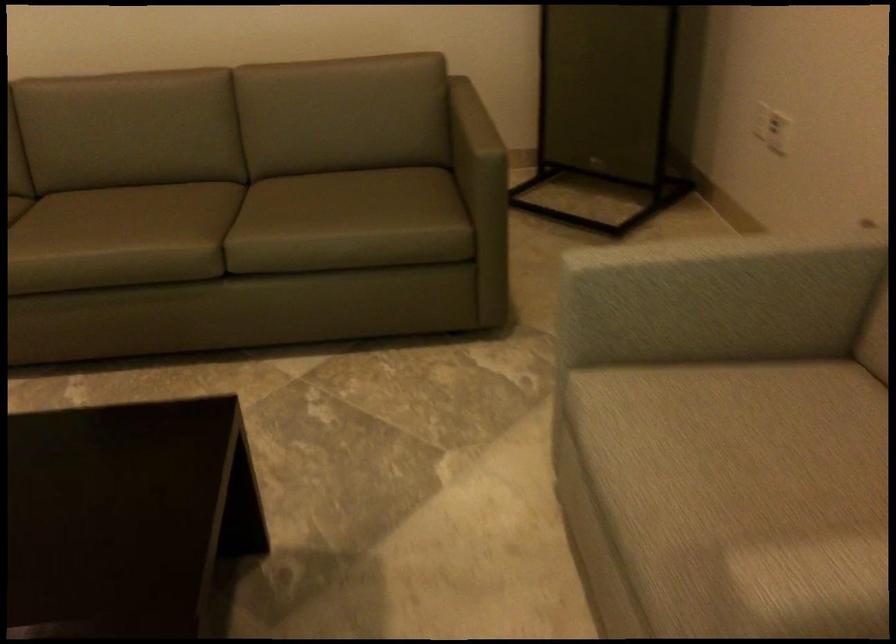
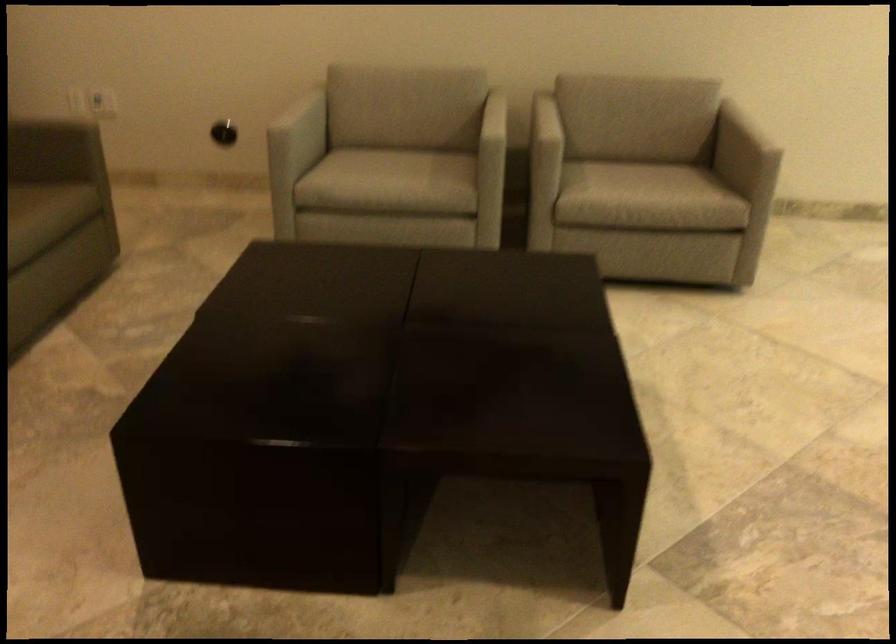
Where in the second image is the point corresponding to (703,497) from the first image?

(390, 176)